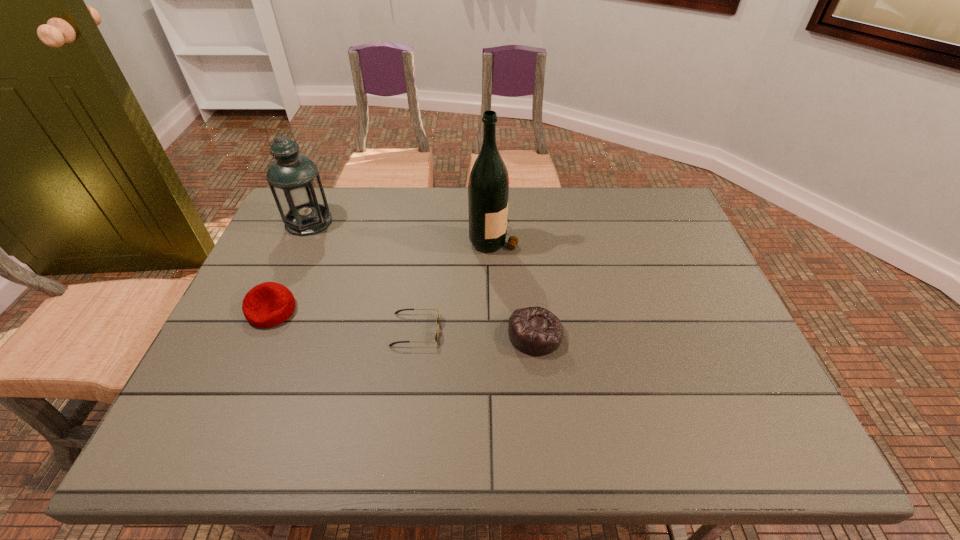
Image resolution: width=960 pixels, height=540 pixels. I want to click on free space located 0.110m on the front-facing side of the third object from left to right, so click(x=484, y=330).

This screenshot has width=960, height=540. I want to click on wine bottle that is positioned at the far edge, so (x=488, y=188).

Where is `oil lamp located at the far edge`? oil lamp located at the far edge is located at coordinates (294, 180).

Locate an element on the screen. oil lamp that is at the left edge is located at coordinates (294, 180).

What are the coordinates of `beanbag situated at the left edge` in the screenshot? It's located at (268, 304).

Locate an element on the screen. This screenshot has height=540, width=960. object that is at the far left corner is located at coordinates (294, 180).

In the image, there is a desktop. In order to click on vacant space at the far edge in this screenshot , I will do `click(519, 202)`.

The height and width of the screenshot is (540, 960). Identify the location of free space at the left edge of the desktop. (324, 240).

Find the location of a particular element. This screenshot has height=540, width=960. vacant area at the right edge is located at coordinates (657, 261).

The width and height of the screenshot is (960, 540). What are the coordinates of `free region at the far right corner` in the screenshot? It's located at (631, 197).